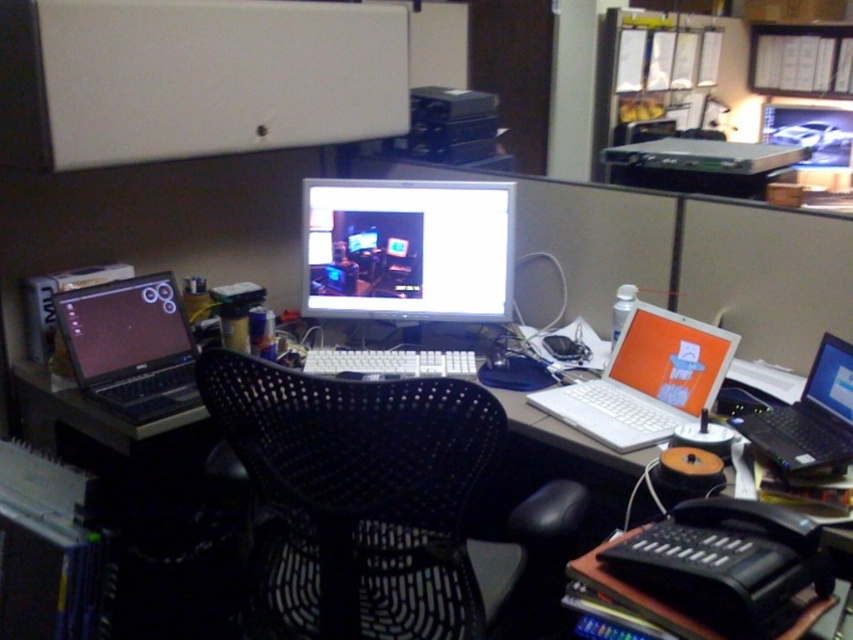
Question: Is white plastic laptop at center-right wider than white plastic laptop at right?

Choices:
 (A) no
 (B) yes

Answer: (B)

Question: Is the position of white plastic computer desk at center more distant than that of matte black laptop at left?

Choices:
 (A) no
 (B) yes

Answer: (A)

Question: Is black mesh swivel chair at center further to camera compared to white plastic computer desk at center?

Choices:
 (A) no
 (B) yes

Answer: (A)

Question: Which of the following is the farthest from the observer?

Choices:
 (A) white plastic laptop at center-right
 (B) white plastic laptop at right
 (C) black mesh swivel chair at center
 (D) white plastic computer desk at center

Answer: (A)

Question: Which object is farther from the camera taking this photo?

Choices:
 (A) white plastic laptop at center-right
 (B) matte black laptop at left
 (C) white plastic laptop at right

Answer: (B)

Question: Among these objects, which one is farthest from the camera?

Choices:
 (A) matte black monitor at center
 (B) black mesh swivel chair at center
 (C) white plastic laptop at center-right
 (D) white plastic computer desk at center

Answer: (A)